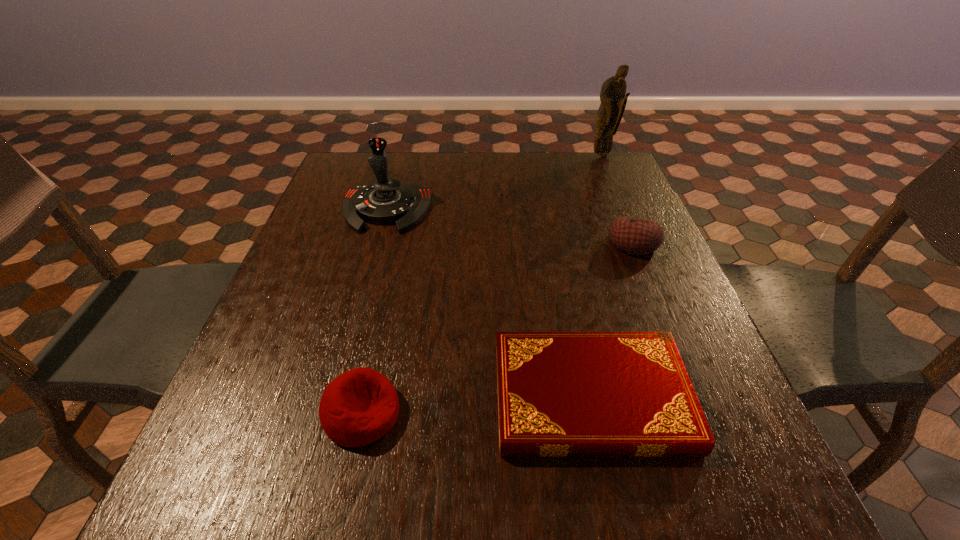
Locate an element on the screen. The height and width of the screenshot is (540, 960). the farthest object is located at coordinates (612, 96).

Locate an element on the screen. This screenshot has width=960, height=540. the tallest object is located at coordinates (612, 96).

At what (x,y) coordinates should I click in order to perform the action: click on joystick. Please return your answer as a coordinate pair (x, y). Looking at the image, I should click on (387, 201).

The image size is (960, 540). Find the location of `the nearer beanbag`. the nearer beanbag is located at coordinates (360, 406).

I want to click on the farther beanbag, so click(x=635, y=236).

Locate an element on the screen. the shortest object is located at coordinates (560, 394).

Where is `free point located on the front-facing side of the figurine`? This screenshot has width=960, height=540. free point located on the front-facing side of the figurine is located at coordinates (613, 184).

Where is `vacant point located 0.160m on the handle side of the joystick`? vacant point located 0.160m on the handle side of the joystick is located at coordinates (368, 278).

Where is `vacant space located 0.210m on the seat area of the left beanbag`? Image resolution: width=960 pixels, height=540 pixels. vacant space located 0.210m on the seat area of the left beanbag is located at coordinates click(522, 413).

At what (x,y) coordinates should I click in order to perform the action: click on free location located on the back of the right beanbag. Please return your answer as a coordinate pair (x, y). The image size is (960, 540). Looking at the image, I should click on (621, 214).